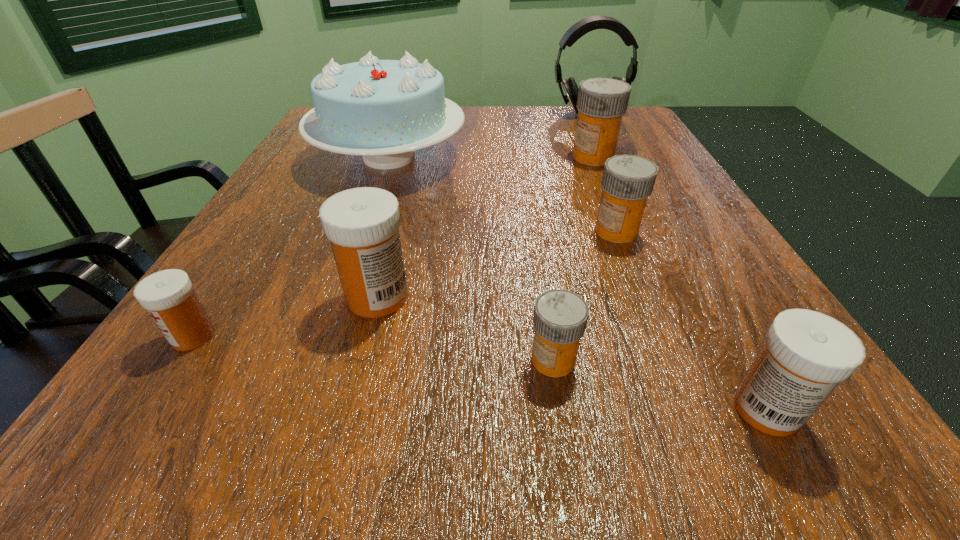
At what (x,y) coordinates should I click in order to perform the action: click on vacant space at the left edge of the desktop. Please return your answer as a coordinate pair (x, y). Looking at the image, I should click on point(295,193).

Where is `vacant space at the right edge of the desktop`? vacant space at the right edge of the desktop is located at coordinates (649, 225).

This screenshot has width=960, height=540. What are the coordinates of `vacant point located between the second smallest white medicine and the earphone` in the screenshot? It's located at (677, 261).

Image resolution: width=960 pixels, height=540 pixels. I want to click on vacant region between the farthest medicine and the birthday cake, so click(491, 157).

The image size is (960, 540). I want to click on unoccupied position between the blue birthday cake and the second smallest orange medicine, so click(502, 194).

The image size is (960, 540). Identify the location of free space between the nearest object and the smallest orange medicine. (660, 384).

This screenshot has height=540, width=960. I want to click on unoccupied area between the biggest orange medicine and the smallest orange medicine, so click(x=573, y=258).

In order to click on free space between the fourth farthest object and the earphone in this screenshot , I will do `click(602, 172)`.

Where is `free space between the nearest medicine and the smallest orange medicine`? The image size is (960, 540). free space between the nearest medicine and the smallest orange medicine is located at coordinates (660, 384).

Find the location of a particular element. Image resolution: width=960 pixels, height=540 pixels. free space between the blue birthday cake and the nearest white medicine is located at coordinates (578, 283).